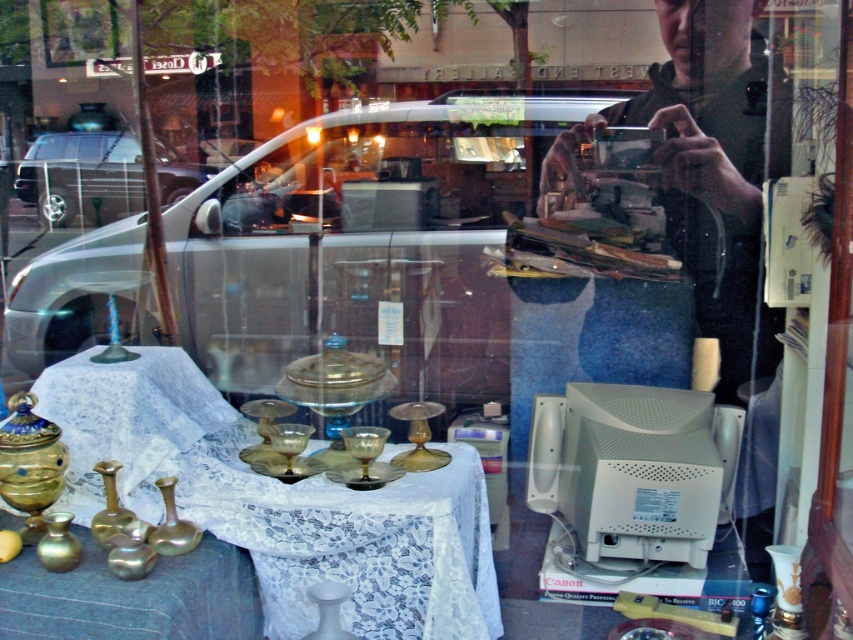
Looking at this image, you are standing outside the shop looking through the window. You notice two points marked on the window. The first point is at coordinates (723, 348) and the second at (80, 176). Which point appears closer to you as you look through the window?

Point (723, 348) is closer to the viewer than point (80, 176).

You are a delivery person carrying a package that measures 5 feet in length. You need to place it between the white lace tablecloth at lower left and the dark green shirt at upper right. Will the package fit without overlapping either object?

The distance between the white lace tablecloth at lower left and the dark green shirt at upper right is 4.97 feet, which is slightly shorter than the 5 feet package. Therefore, the package will not fit without overlapping one of the objects.

You are a delivery person trying to determine if the dark green shirt at upper right can fit into a box designed for items narrower than the metallic silver van at left. Can the shirt fit?

The dark green shirt at upper right has a lesser width compared to the metallic silver van at left, so it can fit into the box designed for items narrower than the metallic silver van at left.